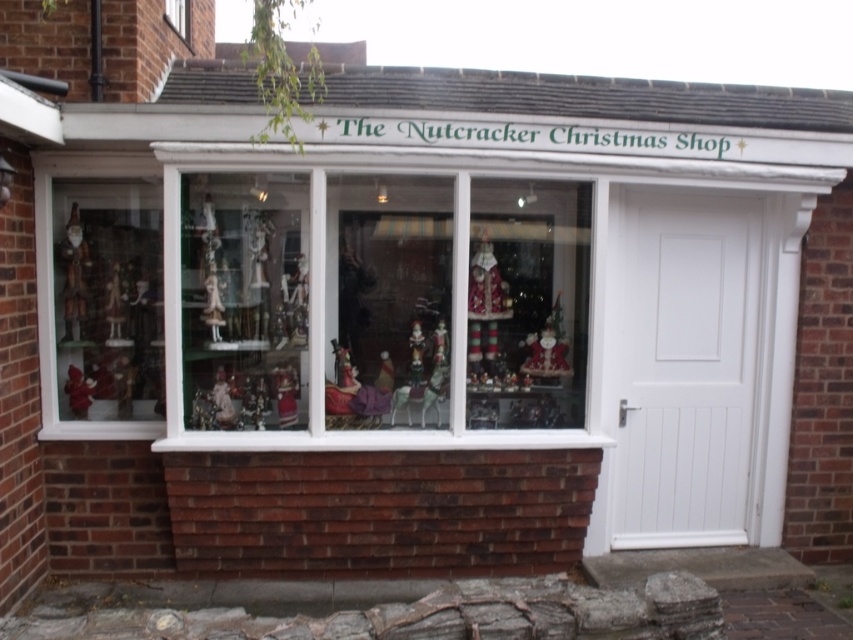
Where is `translucent glass ornaments at center`? This screenshot has height=640, width=853. translucent glass ornaments at center is located at coordinates (386, 310).

Between point (271, 177) and point (281, 396), which one is positioned behind?

Positioned behind is point (281, 396).

This screenshot has height=640, width=853. I want to click on translucent glass ornaments at center, so click(x=386, y=310).

Which is behind, point (456, 243) or point (80, 284)?

The point (80, 284) is behind.

You are a GUI agent. You are given a task and a screenshot of the screen. Output one action in this format:
    pyautogui.click(x=<x>, y=<y>)
    Task: Click on the translucent glass ornaments at center
    
    Given the screenshot: What is the action you would take?
    pyautogui.click(x=386, y=310)

Between wooden figurines at left and wooden santa at left, which one is positioned lower?

Positioned lower is wooden figurines at left.

Looking at this image, can you confirm if wooden figurines at left is smaller than wooden santa at left?

Incorrect, wooden figurines at left is not smaller in size than wooden santa at left.

Image resolution: width=853 pixels, height=640 pixels. What are the coordinates of `wooden figurines at left` in the screenshot? It's located at (100, 305).